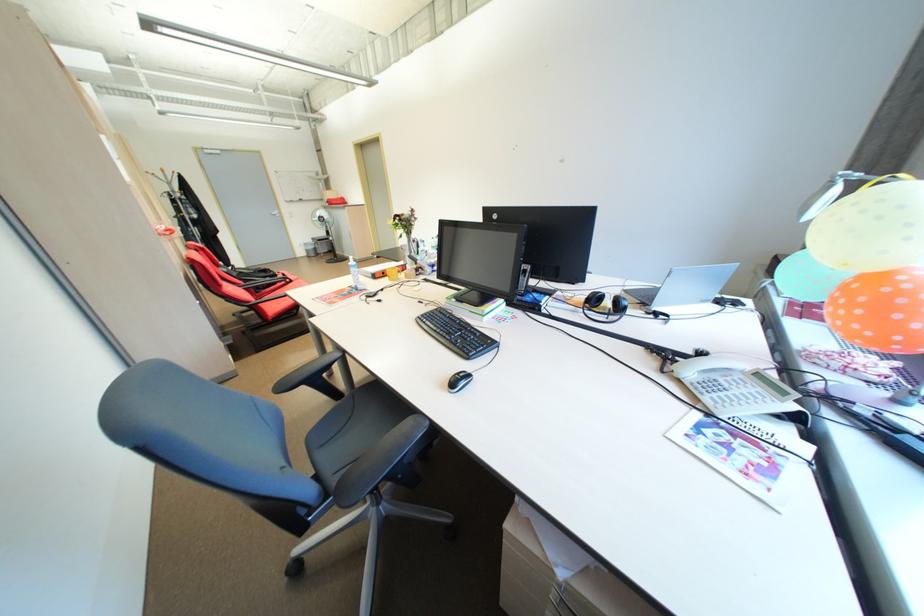
Describe the element at coordinates (271, 213) in the screenshot. Image resolution: width=924 pixels, height=616 pixels. I see `the door handle` at that location.